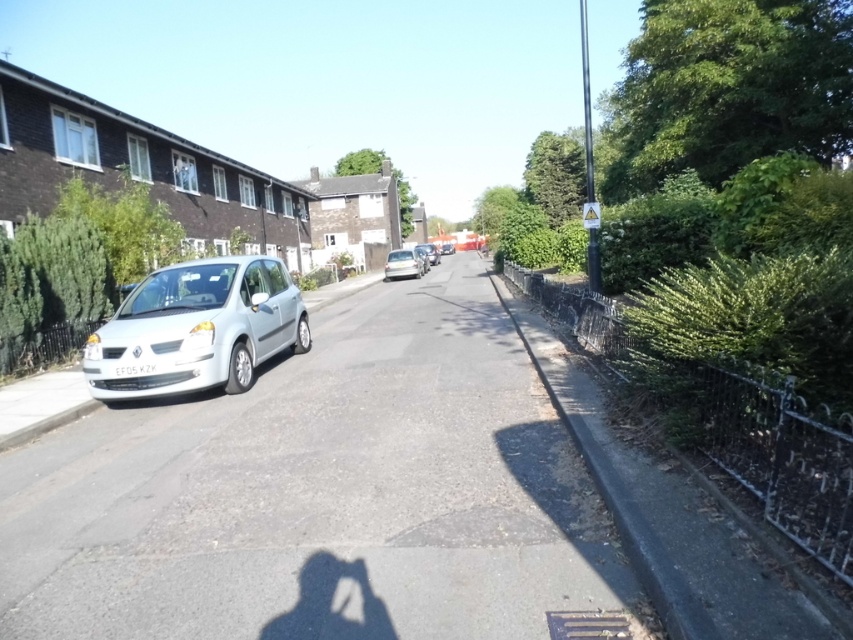
You are a delivery driver who needs to park your van between the white matte car at left and the silver metallic hatchback at center. Your van is 6 meters long. Can you fit your van between them without overlapping either vehicle?

The distance between the white matte car at left and the silver metallic hatchback at center is 14.71 meters. Since your van is only 6 meters long, there is enough space to park it between them without overlapping either vehicle.

You are standing on the sidewalk across the street from the white matte car at left. You want to cross the street to reach the car. The crosswalk is 5 meters away from your current position. Can you safely reach the car without having to walk more than 5 meters from the crosswalk?

The white matte car at left is 4.80 meters from viewer. Since the crosswalk is 5 meters away, you can safely reach the car without exceeding the 5 meter limit.

You are a delivery driver who needs to park your truck, which is 2 meters wide, in this street scene. You see a white matte car at left and a silver metallic hatchback at center. Can you determine which parking spot between these two vehicles can accommodate your truck?

The white matte car at left might be wider than silver metallic hatchback at center, so the space between them may not be wide enough for your 2 meter wide truck. Check the actual width before deciding.